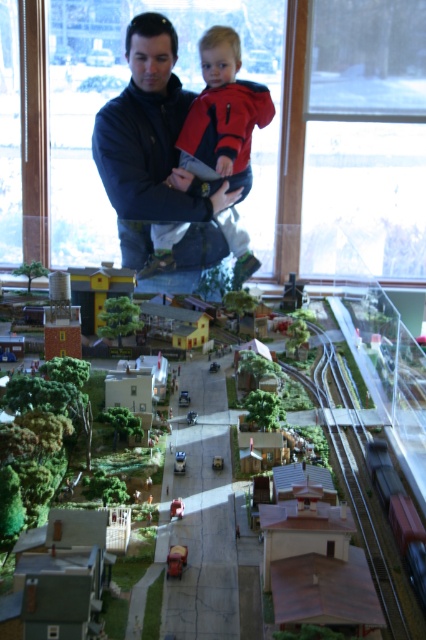
You are a visitor in the model train exhibit and want to walk from the entrance to the exit. The entrance is near point A at coordinates point [400,541] and the exit is near point B at coordinates point [181,568]. Which direction should you walk to go from point A to point B?

Since point [400,541] is behind point [181,568], you should walk forward towards point B to reach the exit from point A.

You are a visitor at the model train exhibit and want to compare the sizes of the two vehicles in the scene. Which one is wider between the red matte train car at bottom right and the metallic red fire truck at center?

The red matte train car at bottom right is wider than the metallic red fire truck at center according to the description provided.

You are navigating a tiny toy car through the miniature town in the image. Your starting position is at point A, which is point (189, 256). You need to reach point B, which is point (169, 573). Will you have to move forward or backward to get closer to point B from point A?

To get closer to point B from point A, you would need to move backward because point A is behind point B according to their coordinates.